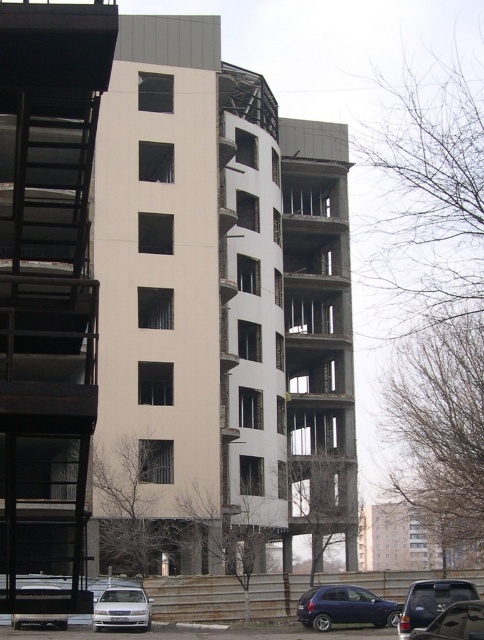
Question: Can you confirm if metallic blue hatchback at lower center is smaller than white matte sedan at lower left?

Choices:
 (A) no
 (B) yes

Answer: (B)

Question: Which of the following is the closest to the observer?

Choices:
 (A) (350, 598)
 (B) (419, 584)
 (C) (106, 614)
 (D) (63, 241)

Answer: (D)

Question: Can you confirm if black metal fire escape at left is positioned to the right of white matte sedan at lower left?

Choices:
 (A) yes
 (B) no

Answer: (B)

Question: Which point is closer to the camera taking this photo?

Choices:
 (A) (108, 611)
 (B) (53, 584)
 (C) (441, 589)

Answer: (B)

Question: Which point is farther to the camera?

Choices:
 (A) (331, 612)
 (B) (105, 600)
 (C) (25, 616)

Answer: (A)

Question: Does white matte sedan at lower left lie in front of silver metallic car at lower left?

Choices:
 (A) no
 (B) yes

Answer: (A)